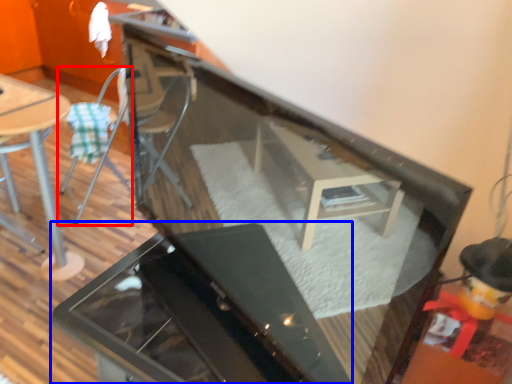
Question: Among these objects, which one is farthest to the camera, chair (highlighted by a red box) or grill (highlighted by a blue box)?

Choices:
 (A) chair
 (B) grill

Answer: (A)